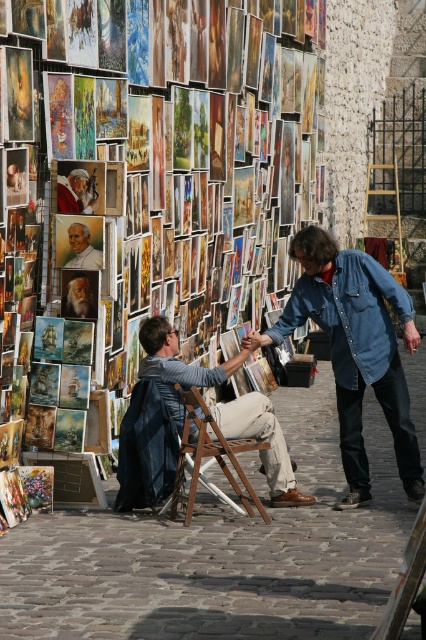
Who is more forward, (x=363, y=374) or (x=212, y=426)?

Point (x=212, y=426) is more forward.

Between denim jacket at lower right and wooden folding chair at center, which one appears on the right side from the viewer's perspective?

denim jacket at lower right

What are the coordinates of `denim jacket at lower right` in the screenshot? It's located at pyautogui.click(x=350, y=316).

Is faded denim jacket at lower right bigger than matte gold frame at center?

Yes, faded denim jacket at lower right is bigger than matte gold frame at center.

Can you confirm if faded denim jacket at lower right is wider than matte gold frame at center?

Yes, faded denim jacket at lower right is wider than matte gold frame at center.

Which is behind, point (422, 497) or point (78, 250)?

The point (78, 250) is more distant.

I want to click on faded denim jacket at lower right, so click(356, 349).

Can you confirm if faded denim jacket at lower right is positioned above matte red jacket at center?

No.

Does faded denim jacket at lower right have a larger size compared to matte red jacket at center?

Indeed, faded denim jacket at lower right has a larger size compared to matte red jacket at center.

Does point (339, 358) come farther from viewer compared to point (65, 188)?

That is True.

Locate an element on the screen. Image resolution: width=426 pixels, height=640 pixels. faded denim jacket at lower right is located at coordinates (356, 349).